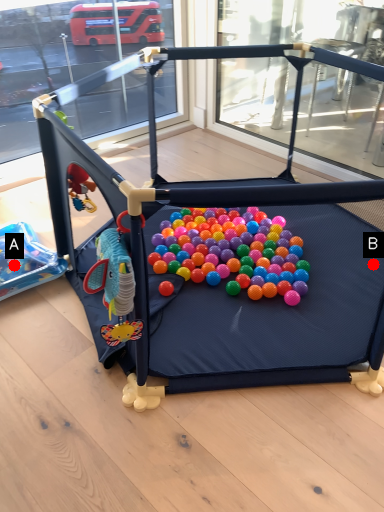
Question: Two points are circled on the image, labeled by A and B beside each circle. Among these points, which one is nearest to the camera?

Choices:
 (A) A is closer
 (B) B is closer

Answer: (B)